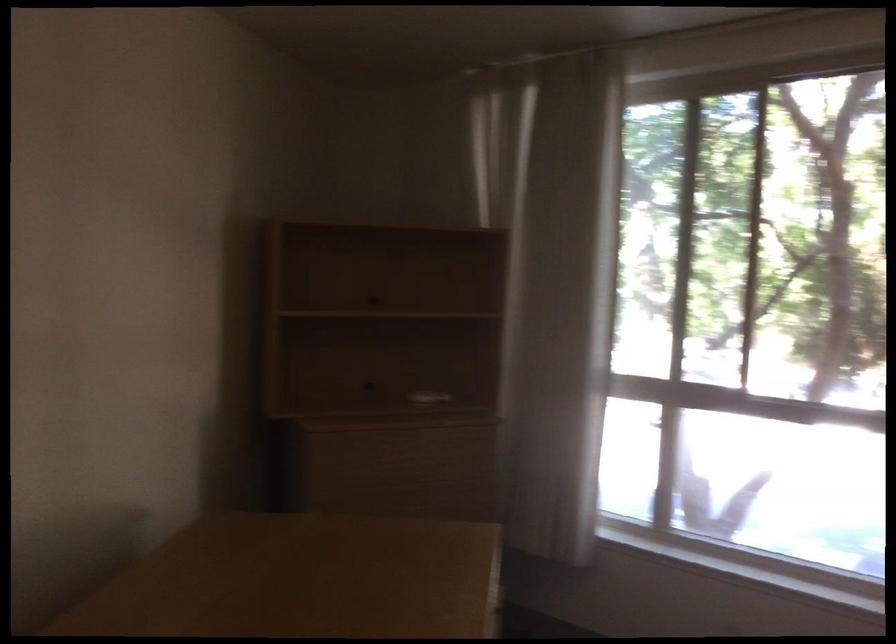
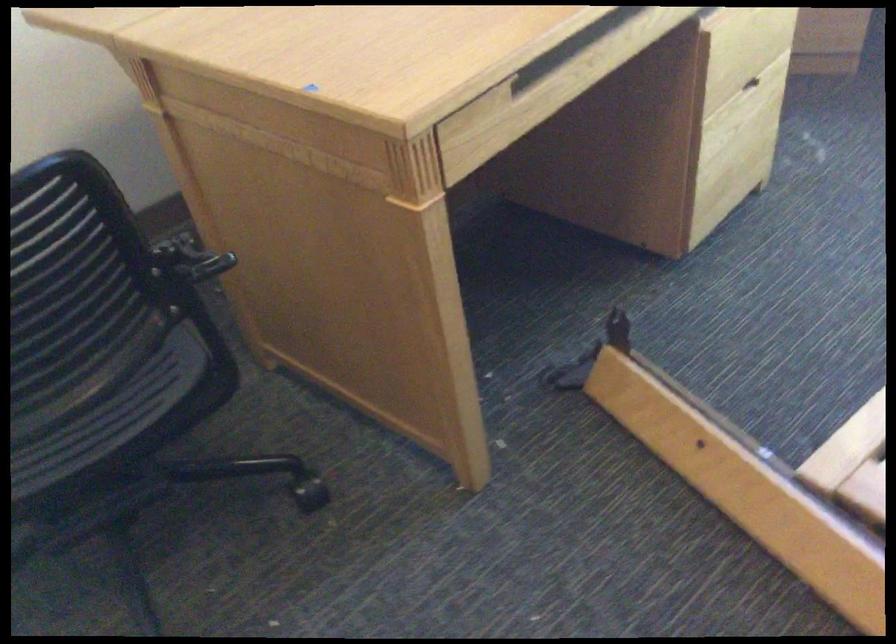
First-person continuous shooting, in which direction is the camera rotating?

The rotation direction of the camera is left-down.